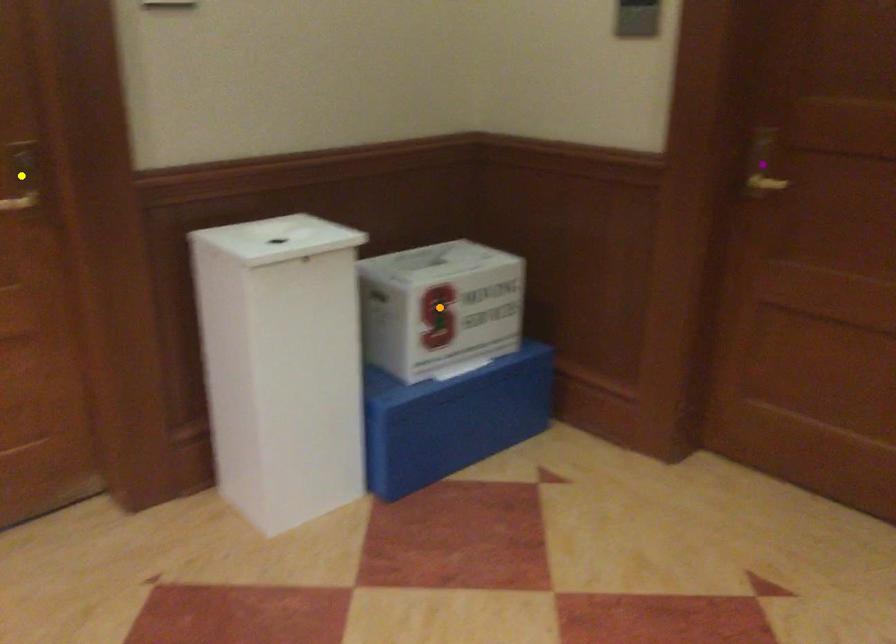
Order these from farthest to nearest:
A) yellow point
B) purple point
C) orange point

1. orange point
2. purple point
3. yellow point